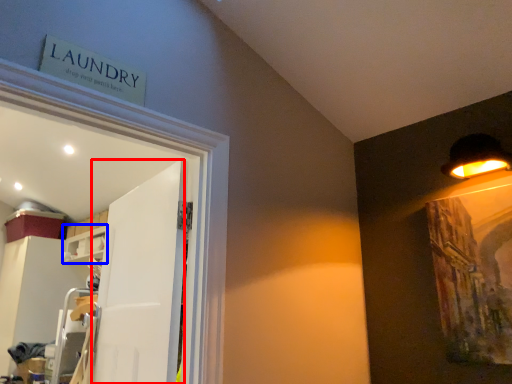
Question: Which object appears closest to the camera in this image, door (highlighted by a red box) or shelf (highlighted by a blue box)?

Choices:
 (A) door
 (B) shelf

Answer: (A)